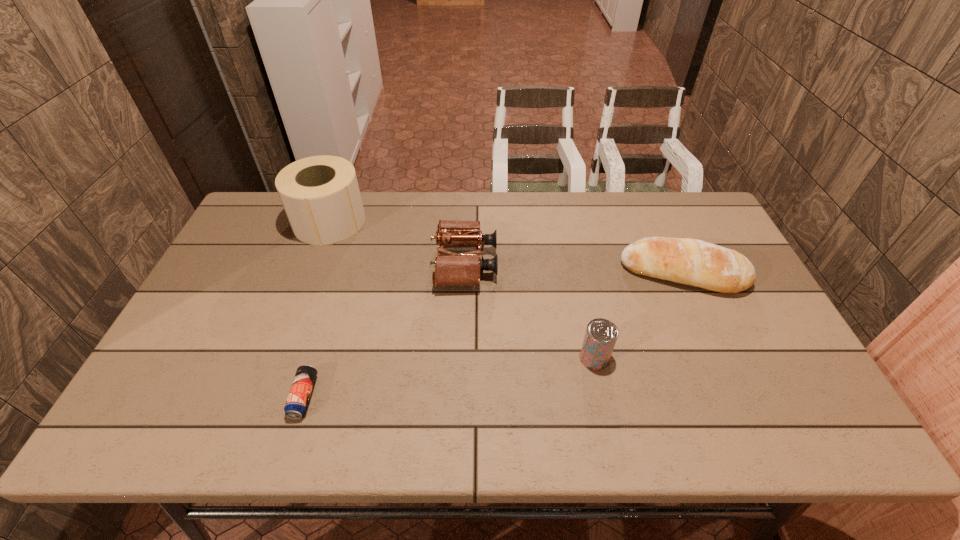
What are the coordinates of `free space that is in between the nearest object and the toilet tissue` in the screenshot? It's located at (317, 309).

Find the location of a particular element. The image size is (960, 540). free space between the fourth farthest object and the binoculars is located at coordinates (530, 311).

I want to click on the second closest object to the tallest object, so click(x=296, y=405).

Point out which object is positioned as the third nearest to the fourth object from left to right. Please provide its 2D coordinates. Your answer should be formatted as a tuple, i.e. [(x, y)], where the tuple contains the x and y coordinates of a point satisfying the conditions above.

[(296, 405)]

Identify the location of vacant area that satisfies the following two spatial constraints: 1. through the eyepieces of the third object from left to right; 2. on the back side of the right beer can. This screenshot has height=540, width=960. (462, 358).

Identify the location of vacant space that satisfies the following two spatial constraints: 1. through the eyepieces of the bread; 2. on the left side of the third object from right to left. This screenshot has width=960, height=540. (465, 273).

I want to click on free space that satisfies the following two spatial constraints: 1. on the back side of the shortest object; 2. on the left side of the right beer can, so pos(316,358).

Where is `vacant space that satisfies the following two spatial constraints: 1. through the eyepieces of the bread; 2. on the left side of the binoculars`? This screenshot has width=960, height=540. vacant space that satisfies the following two spatial constraints: 1. through the eyepieces of the bread; 2. on the left side of the binoculars is located at coordinates (465, 273).

The width and height of the screenshot is (960, 540). I want to click on free region that satisfies the following two spatial constraints: 1. on the back side of the rightmost object; 2. on the right side of the left beer can, so click(342, 273).

Locate an element on the screen. This screenshot has width=960, height=540. vacant area that satisfies the following two spatial constraints: 1. through the eyepieces of the third object from right to left; 2. on the back side of the taller beer can is located at coordinates (462, 358).